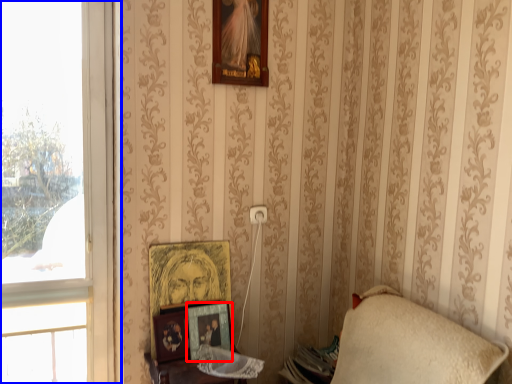
Question: Which object is further to the camera taking this photo, picture frame (highlighted by a red box) or window (highlighted by a blue box)?

Choices:
 (A) picture frame
 (B) window

Answer: (A)